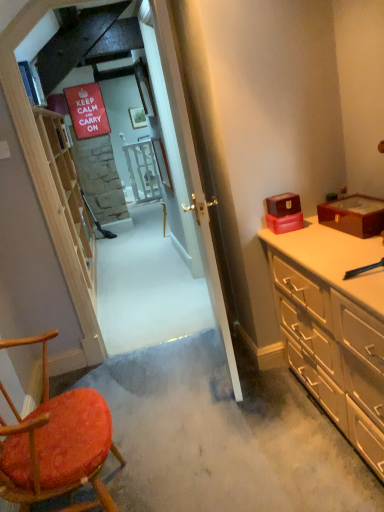
Question: Considering their positions, is light wood shelf at left located in front of or behind beige wood dresser at right?

Choices:
 (A) front
 (B) behind

Answer: (B)

Question: In the image, is light wood shelf at left on the left side or the right side of beige wood dresser at right?

Choices:
 (A) left
 (B) right

Answer: (A)

Question: Which is farther from the shiny burgundy box at right, acting as the 1th box starting from the right?

Choices:
 (A) matte red box at right, the 1th box when ordered from left to right
 (B) beige wood dresser at right
 (C) wooden textured chair at lower left
 (D) light wood shelf at left

Answer: (D)

Question: Which object is positioned closest to the wooden textured chair at lower left?

Choices:
 (A) beige wood dresser at right
 (B) shiny burgundy box at right, which appears as the second box when viewed from the left
 (C) matte red box at right, the second box in the right-to-left sequence
 (D) light wood shelf at left

Answer: (A)